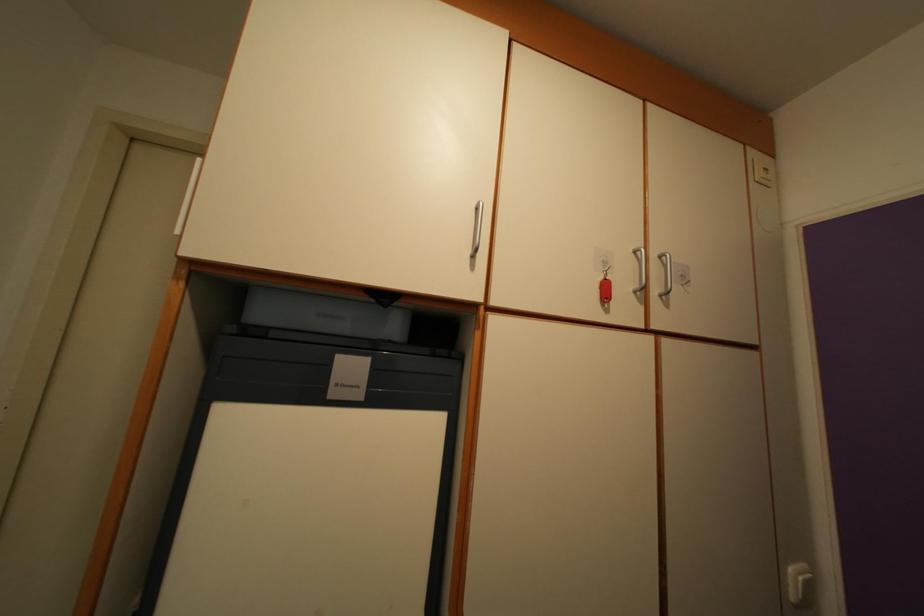
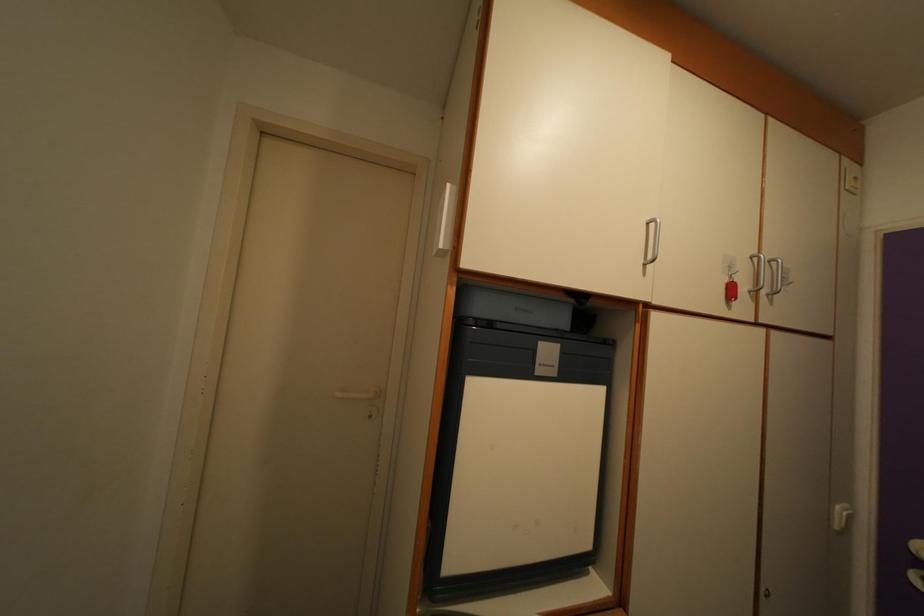
Locate, in the second image, the point that corresponds to the point at 797,583 in the first image.

(843, 519)